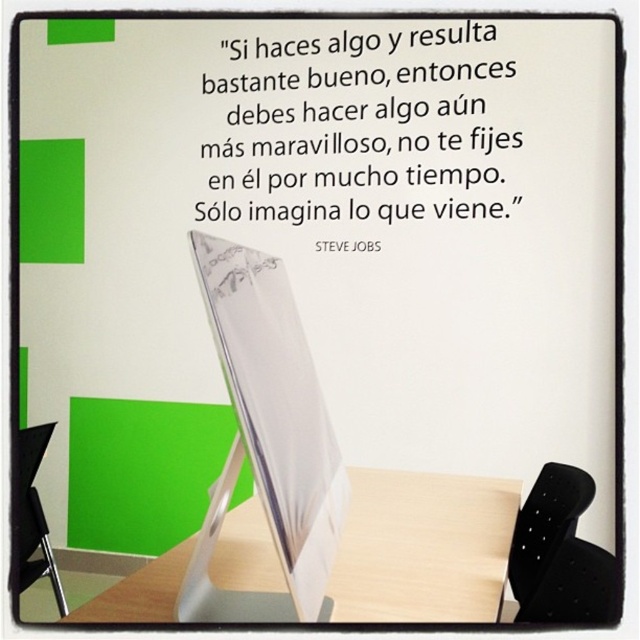
Does silver metallic computer screen at center appear over wooden table at center?

Yes, silver metallic computer screen at center is above wooden table at center.

Is silver metallic computer screen at center taller than wooden table at center?

Yes.

Who is more distant from viewer, (246,266) or (108,600)?

Point (108,600)

Identify the location of silver metallic computer screen at center. (268, 435).